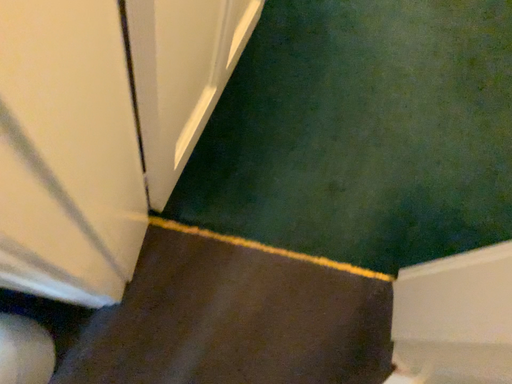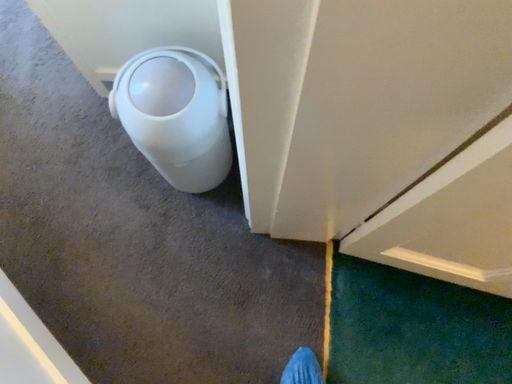
Question: How did the camera likely rotate when shooting the video?

Choices:
 (A) rotated upward
 (B) rotated downward

Answer: (A)